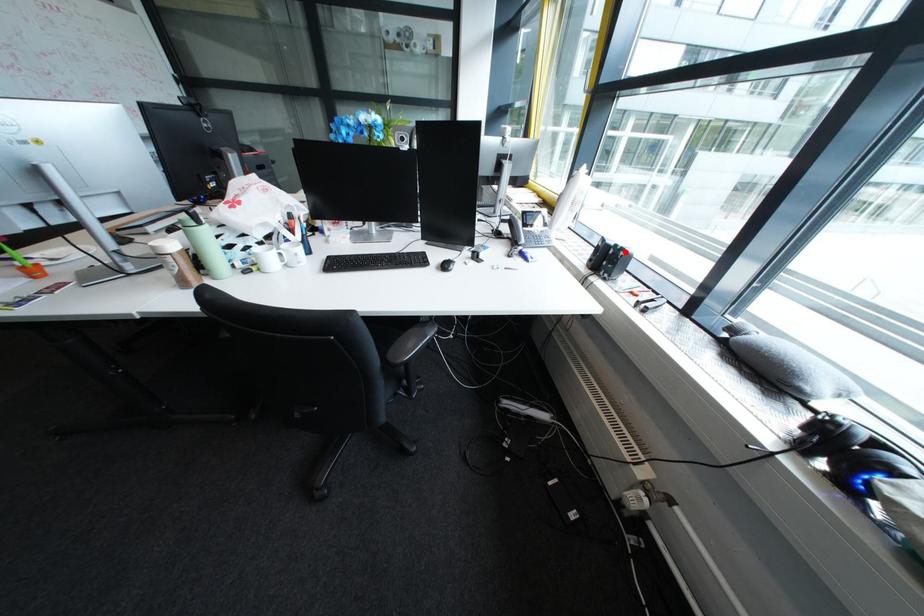
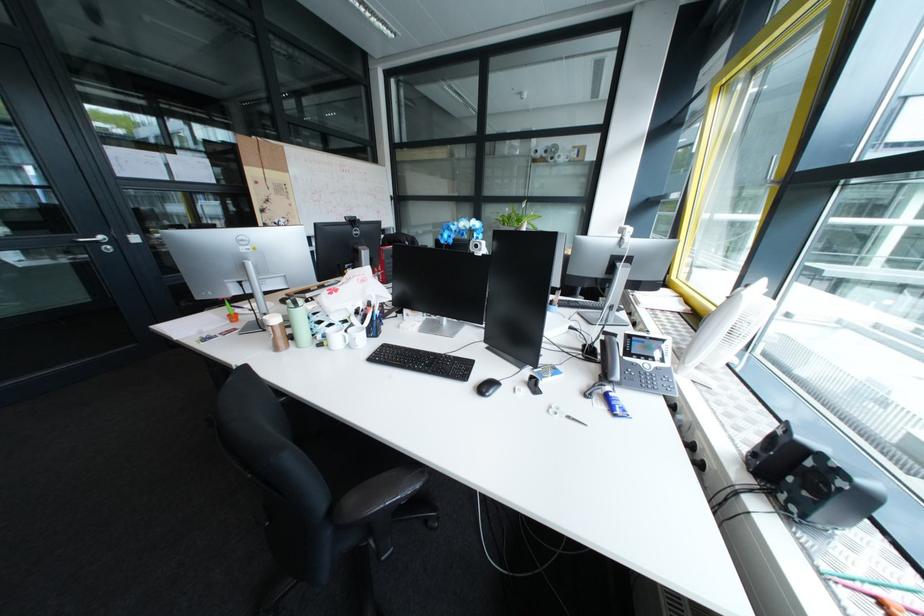
Question: I am providing you with two images of the same scene from different viewpoints. A red point is marked on the first image. At the location where the point appears in image 1, is it still visible in image 2?

Choices:
 (A) Yes
 (B) No

Answer: (A)